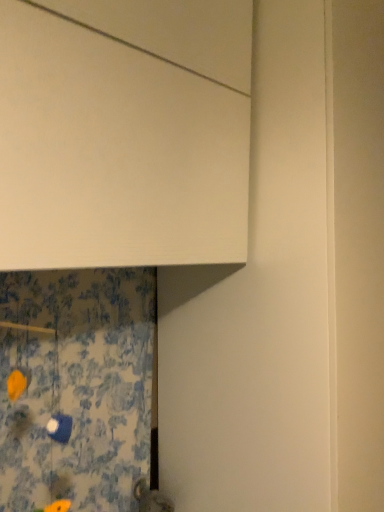
Question: Is blue floral fabric at lower left located outside white matte cabinet at upper center?

Choices:
 (A) no
 (B) yes

Answer: (B)

Question: Can you confirm if blue floral fabric at lower left is taller than white matte cabinet at upper center?

Choices:
 (A) yes
 (B) no

Answer: (B)

Question: From the image's perspective, is blue floral fabric at lower left located above white matte cabinet at upper center?

Choices:
 (A) no
 (B) yes

Answer: (A)

Question: Does blue floral fabric at lower left have a lesser height compared to white matte cabinet at upper center?

Choices:
 (A) no
 (B) yes

Answer: (B)

Question: Is blue floral fabric at lower left at the right side of white matte cabinet at upper center?

Choices:
 (A) yes
 (B) no

Answer: (B)

Question: Are blue floral fabric at lower left and white matte cabinet at upper center located far from each other?

Choices:
 (A) no
 (B) yes

Answer: (A)

Question: From a real-world perspective, is white matte cabinet at upper center over blue floral fabric at lower left?

Choices:
 (A) no
 (B) yes

Answer: (B)

Question: Is white matte cabinet at upper center oriented away from blue floral fabric at lower left?

Choices:
 (A) no
 (B) yes

Answer: (A)

Question: Would you say white matte cabinet at upper center contains blue floral fabric at lower left?

Choices:
 (A) no
 (B) yes

Answer: (A)

Question: From the image's perspective, is white matte cabinet at upper center on blue floral fabric at lower left?

Choices:
 (A) no
 (B) yes

Answer: (B)

Question: Could you tell me if white matte cabinet at upper center is facing blue floral fabric at lower left?

Choices:
 (A) yes
 (B) no

Answer: (B)

Question: Does white matte cabinet at upper center have a lesser height compared to blue floral fabric at lower left?

Choices:
 (A) yes
 (B) no

Answer: (B)

Question: Relative to white matte cabinet at upper center, is blue floral fabric at lower left in front or behind?

Choices:
 (A) front
 (B) behind

Answer: (A)